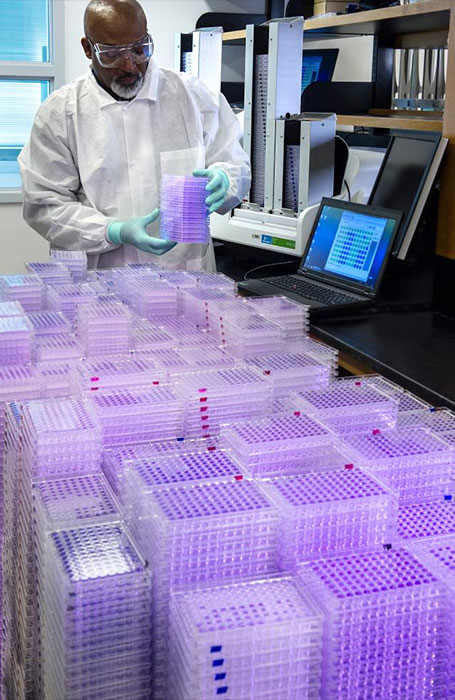
Identify the location of windows. (18, 36), (24, 105).